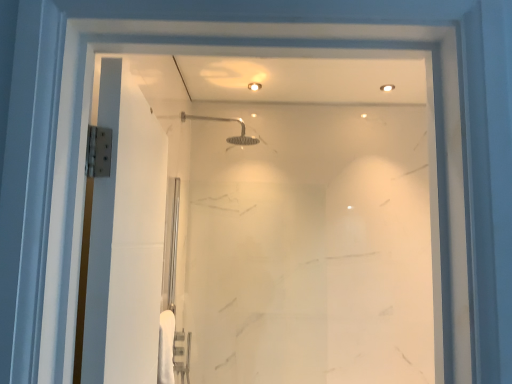
Question: Are satin nickel shower head at upper center and transparent glass door at center far apart?

Choices:
 (A) no
 (B) yes

Answer: (A)

Question: From the image's perspective, would you say satin nickel shower head at upper center is shown under transparent glass door at center?

Choices:
 (A) no
 (B) yes

Answer: (A)

Question: Is satin nickel shower head at upper center turned away from transparent glass door at center?

Choices:
 (A) yes
 (B) no

Answer: (B)

Question: Does satin nickel shower head at upper center lie in front of transparent glass door at center?

Choices:
 (A) yes
 (B) no

Answer: (B)

Question: Can you confirm if satin nickel shower head at upper center is shorter than transparent glass door at center?

Choices:
 (A) yes
 (B) no

Answer: (A)

Question: Does satin nickel shower head at upper center turn towards transparent glass door at center?

Choices:
 (A) yes
 (B) no

Answer: (B)

Question: Does transparent glass door at center have a larger size compared to satin nickel shower head at upper center?

Choices:
 (A) yes
 (B) no

Answer: (A)

Question: Is transparent glass door at center positioned with its back to satin nickel shower head at upper center?

Choices:
 (A) no
 (B) yes

Answer: (A)

Question: Does transparent glass door at center appear on the left side of satin nickel shower head at upper center?

Choices:
 (A) yes
 (B) no

Answer: (B)

Question: Does transparent glass door at center have a lesser width compared to satin nickel shower head at upper center?

Choices:
 (A) no
 (B) yes

Answer: (B)

Question: From a real-world perspective, is transparent glass door at center below satin nickel shower head at upper center?

Choices:
 (A) no
 (B) yes

Answer: (B)

Question: Is transparent glass door at center next to satin nickel shower head at upper center and touching it?

Choices:
 (A) yes
 (B) no

Answer: (B)

Question: From a real-world perspective, is transparent glass door at center positioned above or below satin nickel shower head at upper center?

Choices:
 (A) above
 (B) below

Answer: (B)